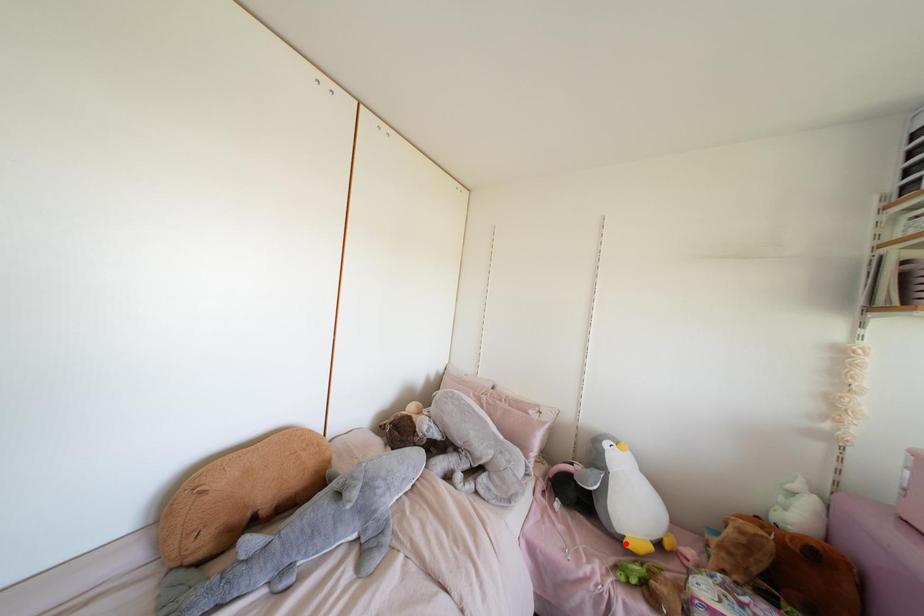
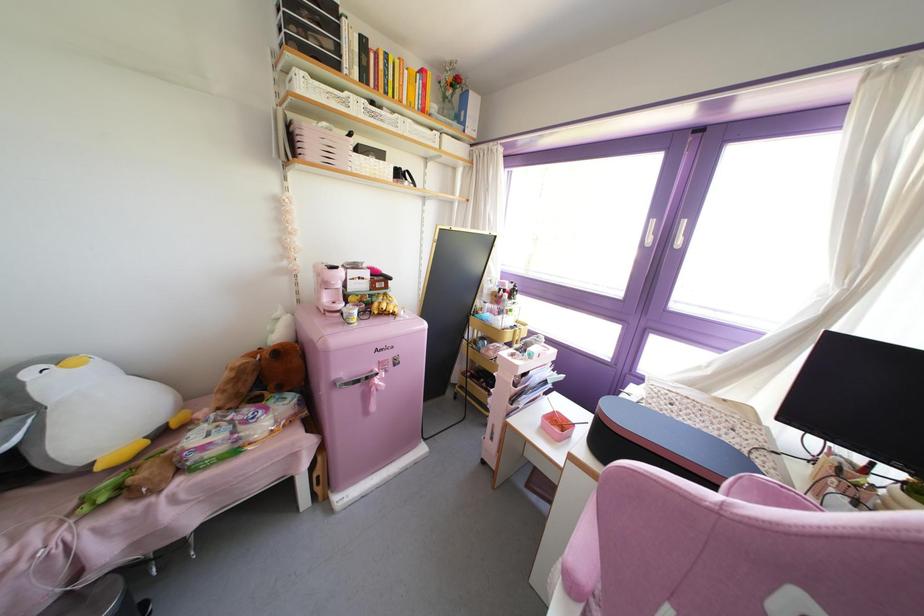
The point at the highlighted location is marked in the first image. Where is the corresponding point in the second image?

(99, 467)